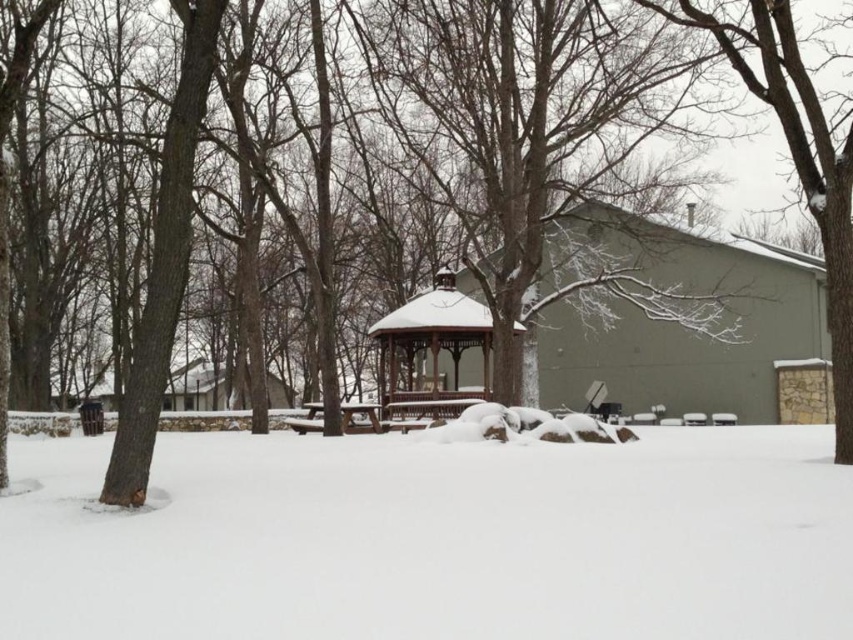
Question: Does snow-covered tree at upper right appear on the right side of wooden gazebo at center?

Choices:
 (A) yes
 (B) no

Answer: (A)

Question: Is white fluffy snow at lower center to the left of wooden gazebo at center from the viewer's perspective?

Choices:
 (A) no
 (B) yes

Answer: (A)

Question: Which point is closer to the camera taking this photo?

Choices:
 (A) (233, 545)
 (B) (357, 413)
 (C) (442, 308)
 (D) (850, 381)

Answer: (A)

Question: Among these objects, which one is nearest to the camera?

Choices:
 (A) wooden gazebo at center
 (B) snow-covered tree at upper right
 (C) brown wooden picnic table at center
 (D) white fluffy snow at lower center

Answer: (D)

Question: Which point is closer to the camera?

Choices:
 (A) (453, 378)
 (B) (328, 512)

Answer: (B)

Question: Is white fluffy snow at lower center in front of wooden gazebo at center?

Choices:
 (A) no
 (B) yes

Answer: (B)